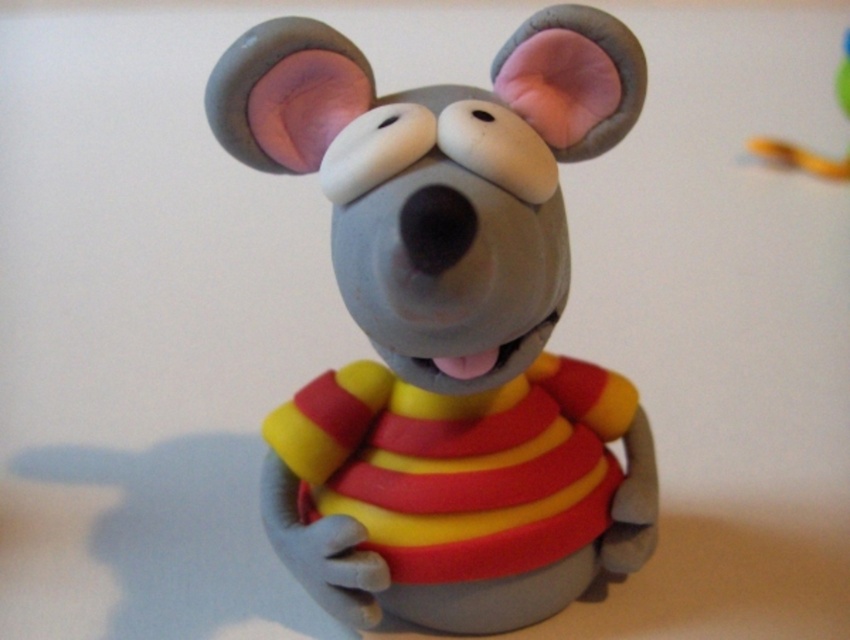
In the scene shown: You are an artist trying to draw the mouse figurine. You want to ensure that the points on the figurine are drawn with the correct perspective. Which of the two points, point (633, 552) or point (794, 157), should be placed closer to the viewer in your drawing?

Point (633, 552) should be placed closer to the viewer because it is closer to the camera than point (794, 157).

Where is the matte clay mouse at center located in the image?

The matte clay mouse at center is located at point coordinates of approximately [446,328].

You are holding a camera and want to take a photo of the mouse figurine. The camera is currently positioned at point (445, 163). If the recommended distance for taking clear photos is at least 3 feet away, is your current position suitable?

The distance between the camera and point (445, 163) is 3.45 feet, which is more than the recommended 3 feet. Therefore, your current position is suitable for taking a clear photo.